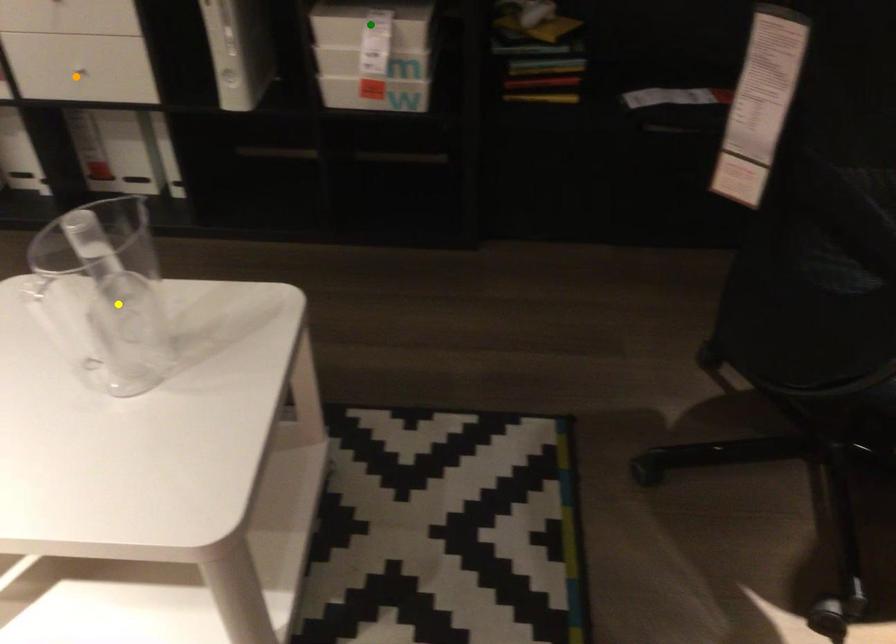
Order these from nearest to farthest:
yellow point | green point | orange point

orange point, green point, yellow point